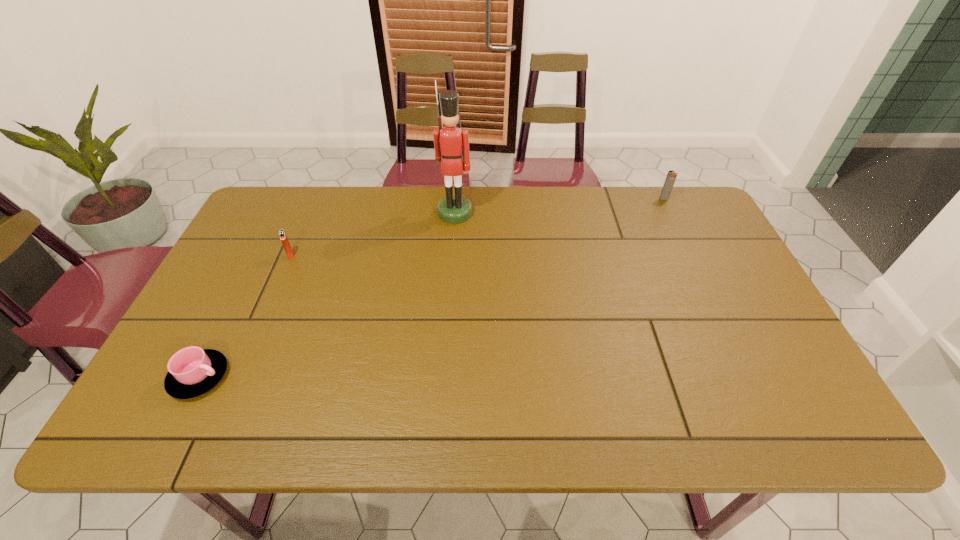
Locate an element on the screen. The height and width of the screenshot is (540, 960). vacant space located on the back of the second object from left to right is located at coordinates (304, 224).

Identify the location of vacant space located on the side with the handle of the nearest object. (403, 376).

The width and height of the screenshot is (960, 540). In order to click on nutcracker at the far edge in this screenshot , I will do `click(448, 140)`.

Find the location of a particular element. igniter that is at the far edge is located at coordinates (669, 182).

Find the location of a particular element. object that is at the near edge is located at coordinates (x=192, y=371).

The width and height of the screenshot is (960, 540). Find the location of `object present at the left edge`. object present at the left edge is located at coordinates (192, 371).

The image size is (960, 540). In order to click on object present at the right edge in this screenshot , I will do `click(669, 182)`.

The height and width of the screenshot is (540, 960). In order to click on object positioned at the near left corner in this screenshot , I will do `click(192, 371)`.

Find the location of a particular element. object present at the far right corner is located at coordinates (669, 182).

This screenshot has height=540, width=960. Identify the location of vacant space at the far edge of the desktop. [x=502, y=190].